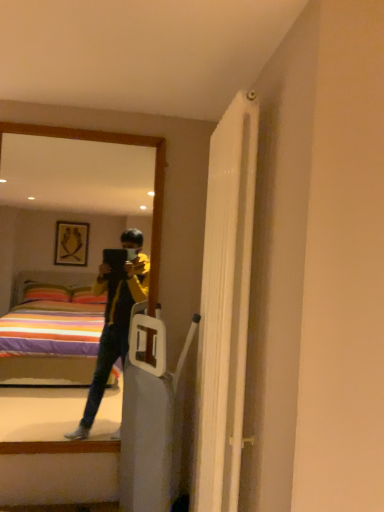
Locate an element on the screen. Image resolution: width=384 pixels, height=512 pixels. white textured radiator at upper right is located at coordinates (225, 307).

Describe the element at coordinates (225, 307) in the screenshot. The width and height of the screenshot is (384, 512). I see `white textured radiator at upper right` at that location.

What is the approximate height of matte black mirror at left?

It is 1.31 meters.

The height and width of the screenshot is (512, 384). What are the coordinates of `matte black mirror at left` in the screenshot? It's located at (62, 248).

What do you see at coordinates (62, 248) in the screenshot? The image size is (384, 512). I see `matte black mirror at left` at bounding box center [62, 248].

Find the location of a particular element. This screenshot has width=384, height=512. white textured radiator at upper right is located at coordinates (225, 307).

Is white textured radiator at upper right to the left of matte black mirror at left from the viewer's perspective?

No.

Considering the positions of objects white textured radiator at upper right and matte black mirror at left in the image provided, who is behind, white textured radiator at upper right or matte black mirror at left?

Positioned behind is matte black mirror at left.

Which is closer, (239, 127) or (152, 181)?

Point (239, 127) is closer to the camera than point (152, 181).

From the image's perspective, is white textured radiator at upper right over matte black mirror at left?

No, from the image's perspective, white textured radiator at upper right is not above matte black mirror at left.

From a real-world perspective, between white textured radiator at upper right and matte black mirror at left, who is vertically lower?

From a 3D spatial view, white textured radiator at upper right is below.

Between white textured radiator at upper right and matte black mirror at left, which one has smaller width?

matte black mirror at left is thinner.

Can you confirm if white textured radiator at upper right is shorter than matte black mirror at left?

Incorrect, the height of white textured radiator at upper right does not fall short of that of matte black mirror at left.

Considering the sizes of objects white textured radiator at upper right and matte black mirror at left in the image provided, who is smaller, white textured radiator at upper right or matte black mirror at left?

With smaller size is matte black mirror at left.

Could matte black mirror at left be considered to be inside white textured radiator at upper right?

No, matte black mirror at left is located outside of white textured radiator at upper right.

Would you say white textured radiator at upper right is a long distance from matte black mirror at left?

They are positioned close to each other.

Is matte black mirror at left at the back of white textured radiator at upper right?

white textured radiator at upper right does not have its back to matte black mirror at left.

Measure the distance from white textured radiator at upper right to matte black mirror at left.

24.97 inches.

I want to click on mirror lying on the left of white textured radiator at upper right, so click(x=62, y=248).

Between matte black mirror at left and white textured radiator at upper right, which one appears on the right side from the viewer's perspective?

white textured radiator at upper right is more to the right.

Which is behind, matte black mirror at left or white textured radiator at upper right?

Positioned behind is matte black mirror at left.

Is point (41, 294) positioned in front of point (224, 371)?

No, (41, 294) is behind (224, 371).

From the image's perspective, which one is positioned higher, matte black mirror at left or white textured radiator at upper right?

matte black mirror at left, from the image's perspective.

From a real-world perspective, which object rests below the other?

white textured radiator at upper right, from a real-world perspective.

Looking at their sizes, would you say matte black mirror at left is wider or thinner than white textured radiator at upper right?

Considering their sizes, matte black mirror at left looks slimmer than white textured radiator at upper right.

Which of these two, matte black mirror at left or white textured radiator at upper right, stands shorter?

matte black mirror at left is shorter.

Between matte black mirror at left and white textured radiator at upper right, which one has smaller size?

matte black mirror at left.

Is white textured radiator at upper right inside matte black mirror at left?

Definitely not — white textured radiator at upper right is not inside matte black mirror at left.

Is matte black mirror at left beside white textured radiator at upper right?

No, matte black mirror at left is not touching white textured radiator at upper right.

Is matte black mirror at left aimed at white textured radiator at upper right?

No.

Where is `mirror that appears above the white textured radiator at upper right (from a real-world perspective)`? The image size is (384, 512). mirror that appears above the white textured radiator at upper right (from a real-world perspective) is located at coordinates (62, 248).

This screenshot has width=384, height=512. In order to click on mirror lying on the left of white textured radiator at upper right in this screenshot , I will do `click(62, 248)`.

Identify the location of mirror above the white textured radiator at upper right (from a real-world perspective). Image resolution: width=384 pixels, height=512 pixels. (62, 248).